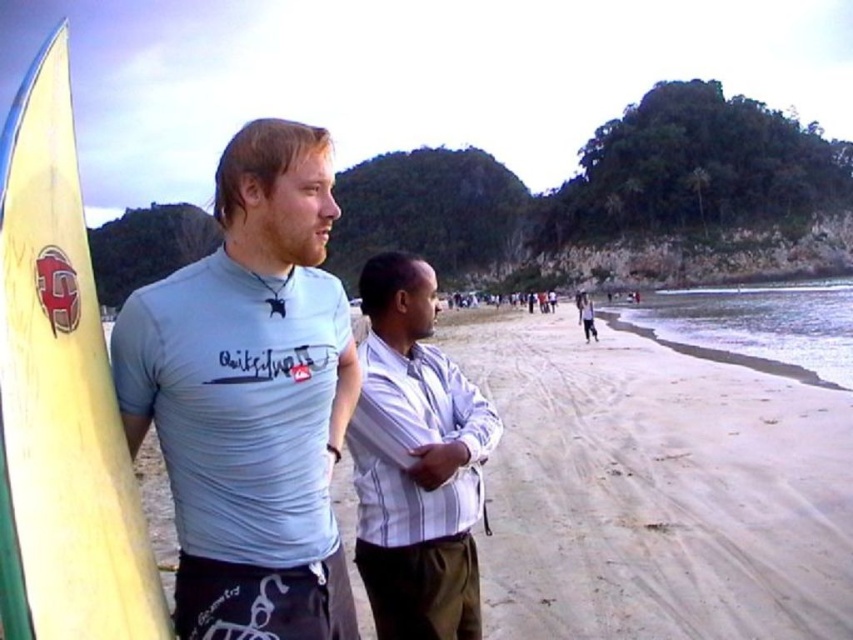
You are a photographer at the beach scene. You want to take a photo that includes both the light blue fabric shirt at left and the yellow matte surfboard at left. Which object should you focus on first to ensure both are in frame?

The light blue fabric shirt at left has a lesser height compared to the yellow matte surfboard at left, so you should focus on the yellow matte surfboard at left first to ensure both are in frame.

You are a photographer trying to capture both the light blue fabric shirt at left and the white striped shirt at center in a single frame. Since you want to ensure both are visible, which shirt should you focus on first to maintain clarity, considering their sizes?

The light blue fabric shirt at left is bigger than the white striped shirt at center, so you should focus on the light blue fabric shirt at left first to ensure its clarity before adjusting for the smaller one.